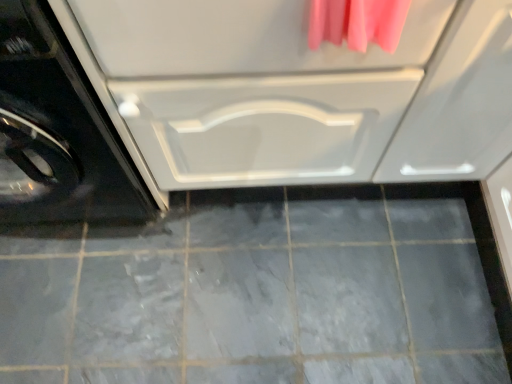
Identify the location of white glossy drawer at center. This screenshot has width=512, height=384. (253, 89).

The image size is (512, 384). What do you see at coordinates (58, 132) in the screenshot?
I see `black glossy washing machine at left` at bounding box center [58, 132].

Locate an element on the screen. white glossy drawer at center is located at coordinates (253, 89).

How different are the orientations of gray matte tile at center and white glossy drawer at center in degrees?

They differ by 89.5 degrees in their facing directions.

Find the location of `ceramic tile that appears behind the white glossy drawer at center`. ceramic tile that appears behind the white glossy drawer at center is located at coordinates (264, 291).

From a real-world perspective, is gray matte tile at center above or below white glossy drawer at center?

gray matte tile at center is situated lower than white glossy drawer at center in the real world.

Considering the sizes of gray matte tile at center and white glossy drawer at center in the image, is gray matte tile at center bigger or smaller than white glossy drawer at center?

Considering their sizes, gray matte tile at center takes up less space than white glossy drawer at center.

Is white glossy drawer at center located outside gray matte tile at center?

That's correct, white glossy drawer at center is outside of gray matte tile at center.

Is white glossy drawer at center to the left or to the right of gray matte tile at center in the image?

Clearly, white glossy drawer at center is on the right of gray matte tile at center in the image.

Can you confirm if white glossy drawer at center is wider than gray matte tile at center?

No.

Is white glossy drawer at center positioned far away from gray matte tile at center?

No, there isn't a large distance between white glossy drawer at center and gray matte tile at center.

Who is bigger, black glossy washing machine at left or gray matte tile at center?

black glossy washing machine at left is bigger.

Is gray matte tile at center located within black glossy washing machine at left?

No, black glossy washing machine at left does not contain gray matte tile at center.

From a real-world perspective, does black glossy washing machine at left sit lower than gray matte tile at center?

No, from a real-world perspective, black glossy washing machine at left is not below gray matte tile at center.

Considering the positions of objects white glossy drawer at center and black glossy washing machine at left in the image provided, who is in front, white glossy drawer at center or black glossy washing machine at left?

black glossy washing machine at left is more forward.

From a real-world perspective, is white glossy drawer at center positioned over black glossy washing machine at left based on gravity?

No, from a real-world perspective, white glossy drawer at center is not above black glossy washing machine at left.

Locate an element on the screen. The image size is (512, 384). washing machine in front of the white glossy drawer at center is located at coordinates (58, 132).

Which of these two, white glossy drawer at center or black glossy washing machine at left, is bigger?

Bigger between the two is white glossy drawer at center.

What are the coordinates of `washing machine located below the white glossy drawer at center (from the image's perspective)` in the screenshot? It's located at (58, 132).

Is black glossy washing machine at left smaller than white glossy drawer at center?

Indeed, black glossy washing machine at left has a smaller size compared to white glossy drawer at center.

In the scene shown: From the image's perspective, which object appears higher, black glossy washing machine at left or white glossy drawer at center?

From the image's view, white glossy drawer at center is above.

Can you confirm if black glossy washing machine at left is taller than white glossy drawer at center?

Indeed, black glossy washing machine at left has a greater height compared to white glossy drawer at center.

Can you confirm if gray matte tile at center is positioned to the left of black glossy washing machine at left?

In fact, gray matte tile at center is to the right of black glossy washing machine at left.

Is gray matte tile at center positioned with its back to black glossy washing machine at left?

That's not correct — gray matte tile at center is not looking away from black glossy washing machine at left.

Which of these two, gray matte tile at center or black glossy washing machine at left, is smaller?

With smaller size is gray matte tile at center.

At what (x,y) coordinates should I click in order to perform the action: click on drawer that appears above the gray matte tile at center (from a real-world perspective). Please return your answer as a coordinate pair (x, y). Looking at the image, I should click on (253, 89).

Identify the location of ceramic tile that appears below the white glossy drawer at center (from the image's perspective). [264, 291].

Looking at this image, from the image, which object appears to be farther from black glossy washing machine at left, white glossy drawer at center or gray matte tile at center?

The object further to black glossy washing machine at left is gray matte tile at center.

Consider the image. Based on their spatial positions, is gray matte tile at center or black glossy washing machine at left closer to white glossy drawer at center?

black glossy washing machine at left is positioned closer to the anchor white glossy drawer at center.

Based on their spatial positions, is gray matte tile at center or white glossy drawer at center closer to black glossy washing machine at left?

Based on the image, white glossy drawer at center appears to be nearer to black glossy washing machine at left.

Considering their positions, is black glossy washing machine at left positioned further to white glossy drawer at center than gray matte tile at center?

Among the two, gray matte tile at center is located further to white glossy drawer at center.

Based on the photo, estimate the real-world distances between objects in this image. Which object is closer to gray matte tile at center, black glossy washing machine at left or white glossy drawer at center?

black glossy washing machine at left lies closer to gray matte tile at center than the other object.

Considering their positions, is white glossy drawer at center positioned further to gray matte tile at center than black glossy washing machine at left?

Based on the image, white glossy drawer at center appears to be further to gray matte tile at center.

You are a GUI agent. You are given a task and a screenshot of the screen. Output one action in this format:
    pyautogui.click(x=<x>, y=<y>)
    Task: Click on the ceramic tile between black glossy washing machine at left and white glossy drawer at center
    This screenshot has height=384, width=512.
    Given the screenshot: What is the action you would take?
    pyautogui.click(x=264, y=291)